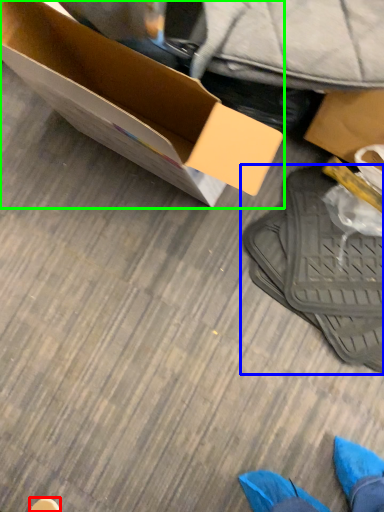
Question: Which object is the closest to the shoe (highlighted by a red box)? Choose among these: footwear (highlighted by a blue box) or box (highlighted by a green box).

Choices:
 (A) footwear
 (B) box

Answer: (A)